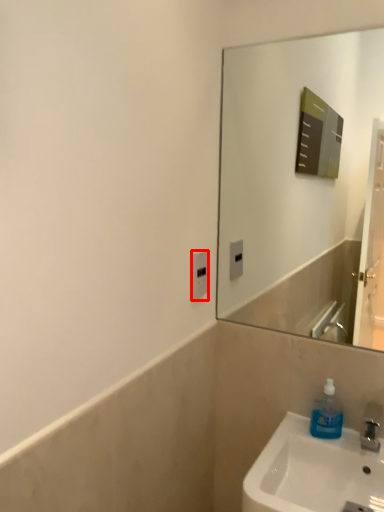
Question: From the image, what is the correct spatial relationship of electric outlet (annotated by the red box) in relation to soap dispenser?

Choices:
 (A) left
 (B) right

Answer: (A)